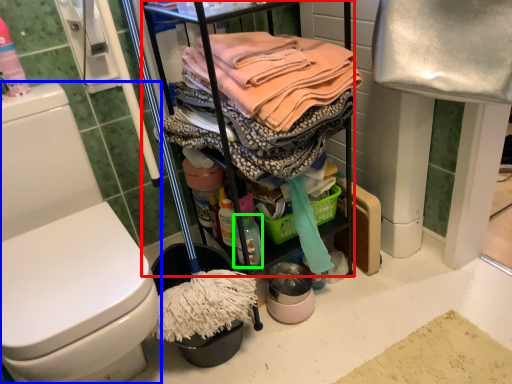
Question: Based on their relative distances, which object is farther from cabinetry (highlighted by a red box)? Choose from toilet (highlighted by a blue box) and cleaning products (highlighted by a green box).

Choices:
 (A) toilet
 (B) cleaning products

Answer: (A)